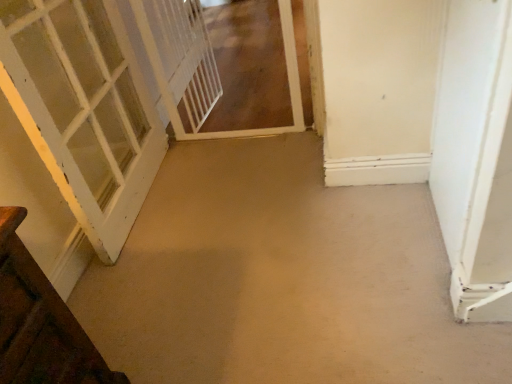
At what (x,y) coordinates should I click in order to perform the action: click on vacant space to the right of white painted wood door at left, which is the third door in right-to-left order. Please return your answer as a coordinate pair (x, y). The width and height of the screenshot is (512, 384). Looking at the image, I should click on (240, 190).